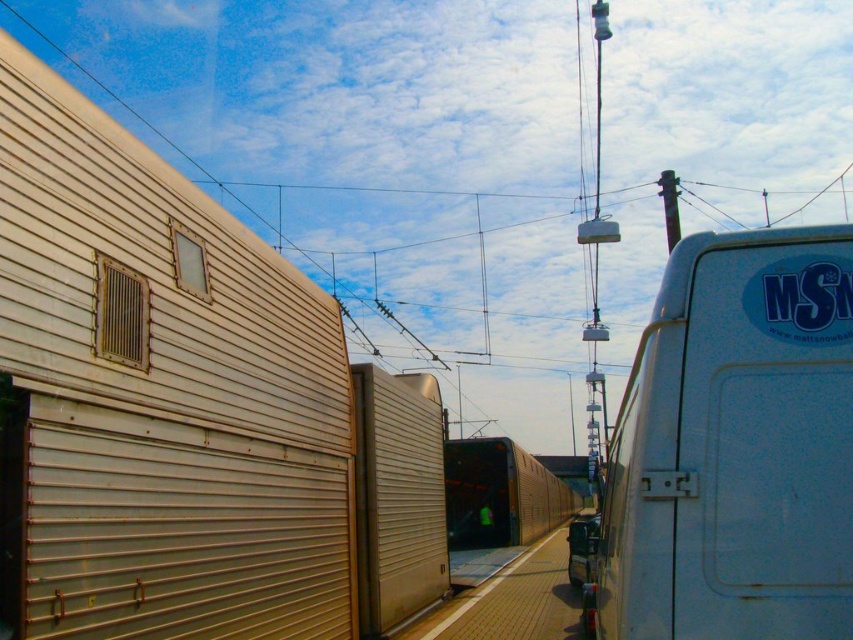
In the scene shown: You are a delivery person who needs to park your 2.5 meter wide truck between the white speckled van at right and the metallic silver train at center. Can your truck fit in the space between them?

The white speckled van at right has a lesser width compared to metallic silver train at center, so the space between them may be sufficient to park a 2.5 meter wide truck. However, without knowing the exact distance between the vehicles, it is impossible to confirm if the truck will fit.

You are a delivery driver who needs to park your van 30 meters away from the metallic silver train at center. Can you park your white speckled van at right at the current position to meet this requirement?

The white speckled van at right is currently 29.61 meters from the metallic silver train at center, which is less than the required 30 meters. Therefore, you cannot park the white speckled van at right at its current position to meet the 30 meters requirement.

You are standing at the railway station and want to take a photo of both the white speckled van at right and the metallic silver train at center. Which object should you focus on first to ensure both are in the frame?

You should focus on the metallic silver train at center first because the white speckled van at right is closer to the viewer, so adjusting the camera to include both would require framing starting from the closer van and extending to the farther train.